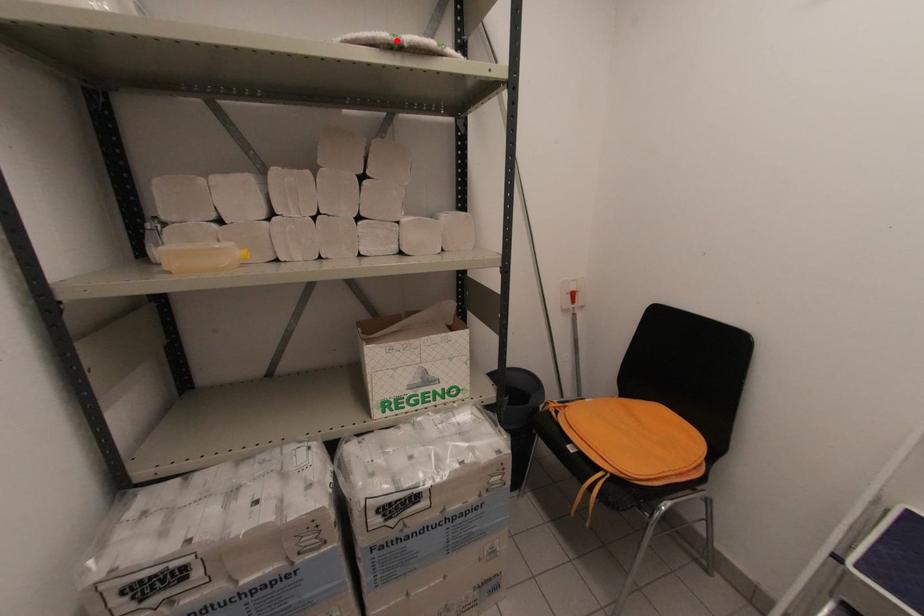
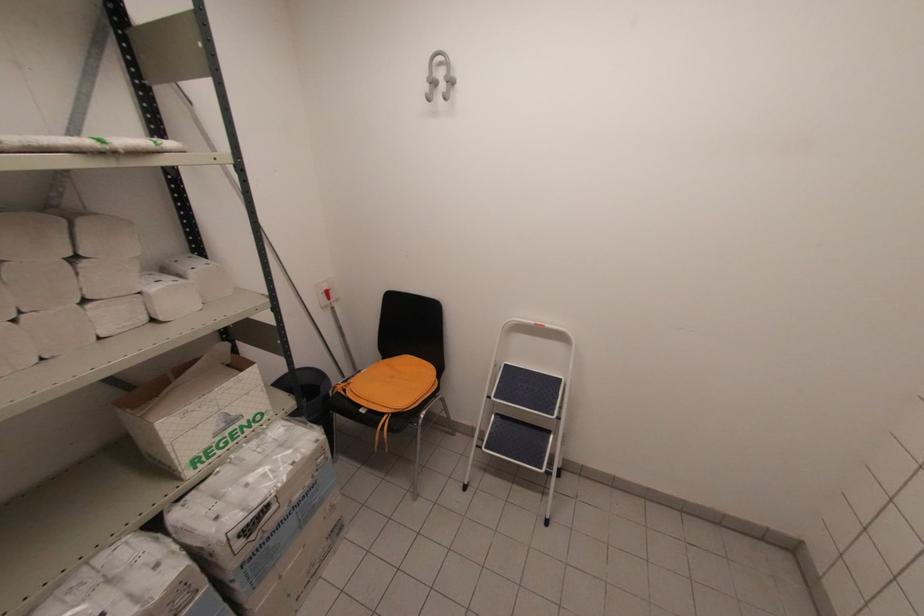
Find the pixel in the second image that matches the highlighted location in the first image.

(107, 148)